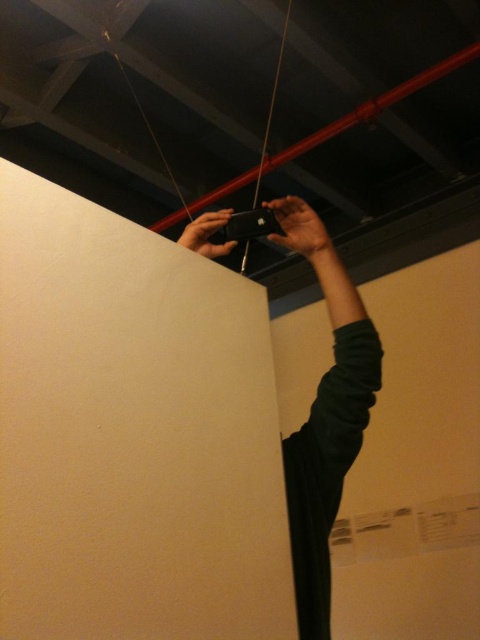
Question: Which point is closer to the camera?

Choices:
 (A) (228, 209)
 (B) (349, 364)

Answer: (B)

Question: Does black matte phone at upper center come behind matte black phone at center?

Choices:
 (A) yes
 (B) no

Answer: (B)

Question: Where is black matte phone at upper center located in relation to matte black phone at center in the image?

Choices:
 (A) above
 (B) below

Answer: (B)

Question: Does black matte phone at upper center have a lesser width compared to dark green fabric at upper center?

Choices:
 (A) no
 (B) yes

Answer: (A)

Question: Which is nearer to the black matte phone at upper center?

Choices:
 (A) matte black phone at center
 (B) black matte string at center
 (C) dark green fabric at upper center

Answer: (C)

Question: Which of the following is the closest to the observer?

Choices:
 (A) black matte phone at upper center
 (B) dark green fabric at upper center
 (C) black matte string at center

Answer: (A)